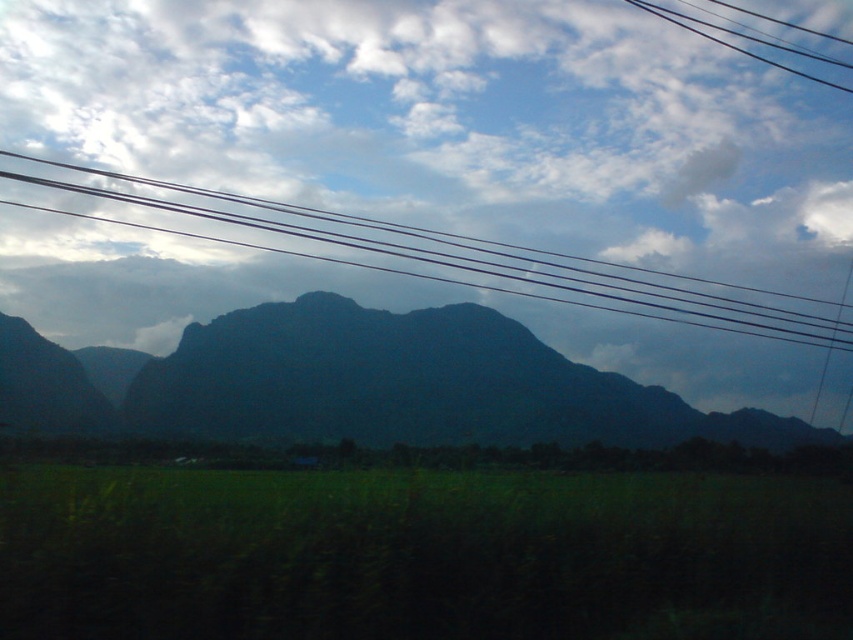
You are a bird flying over the landscape. You see the dark green mountain at center and the black wires at upper center. Which object is higher in the sky?

The black wires at upper center are higher in the sky than the dark green mountain at center because the mountain is positioned below the wires.

In the scene shown: You are a bird flying over the landscape. You notice the dark green mountain at center and the black wires at upper center. Which of these two objects takes up more visual space in the sky?

The black wires at upper center occupy more visual space than the dark green mountain at center.